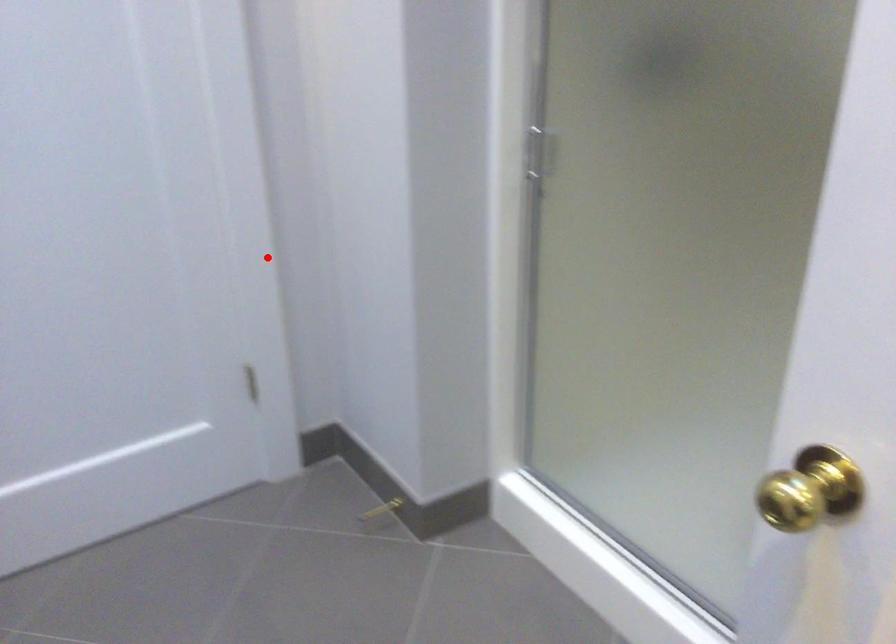
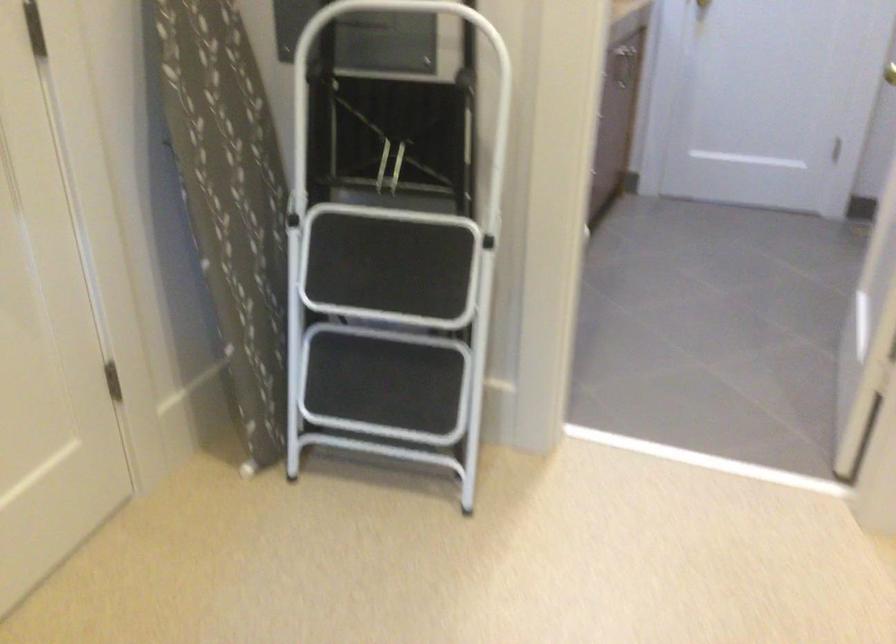
In the second image, find the point that corresponds to the highlighted location in the first image.

(890, 73)